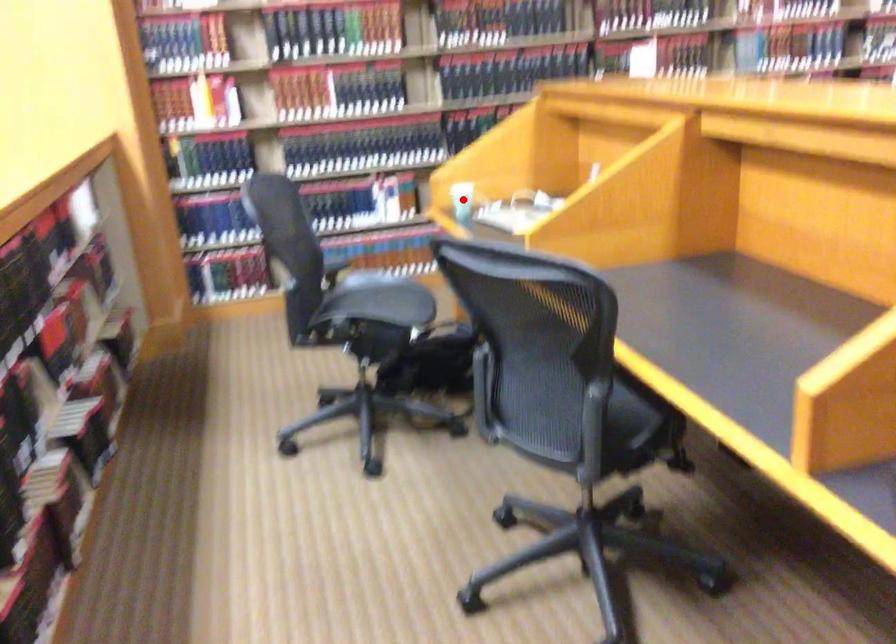
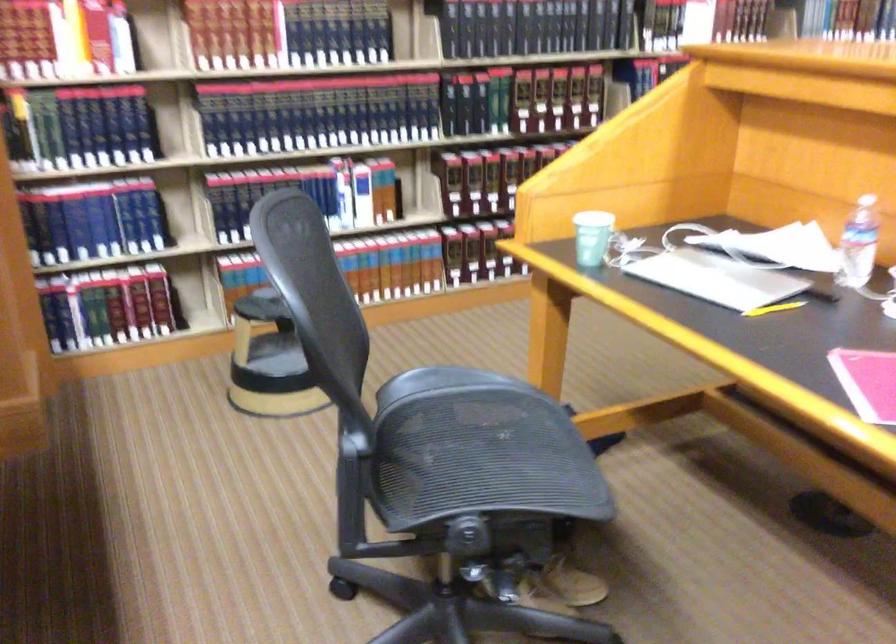
Find the pixel in the second image that matches the highlighted location in the first image.

(591, 237)